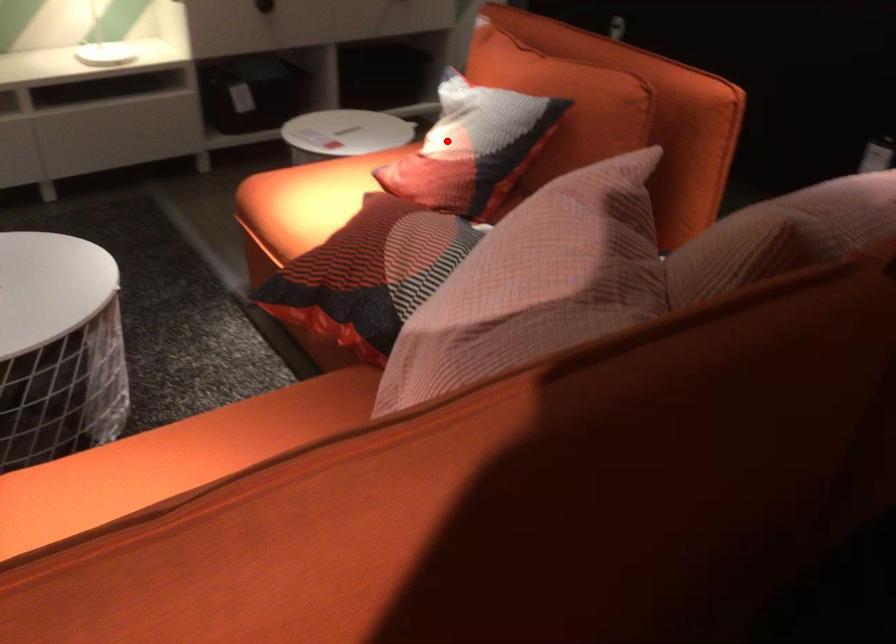
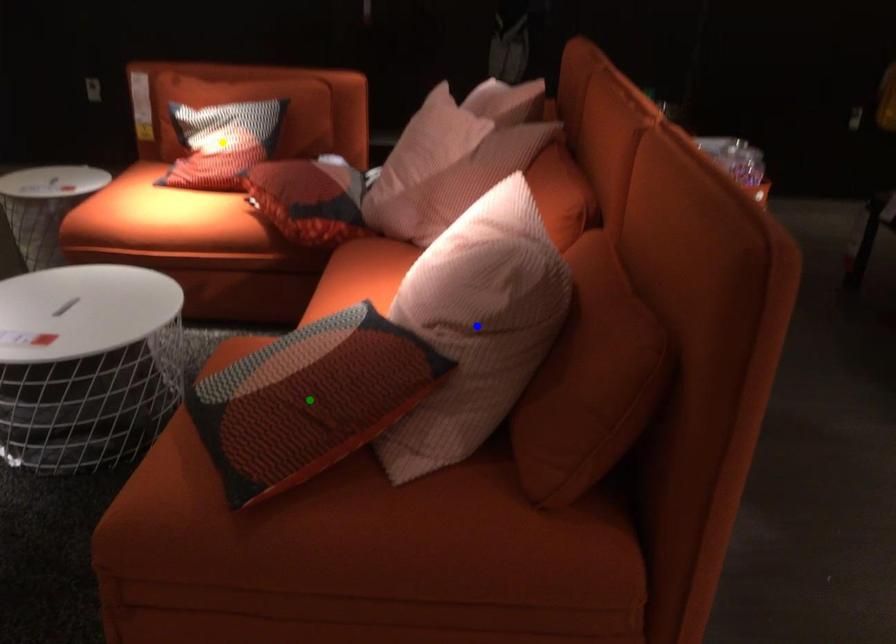
Question: I am providing you with two images of the same scene from different viewpoints. A red point is marked on the first image. You are given multiple points on the second image. Can you choose the point in image 2 that corresponds to the point in image 1?

Choices:
 (A) yellow point
 (B) green point
 (C) blue point

Answer: (A)